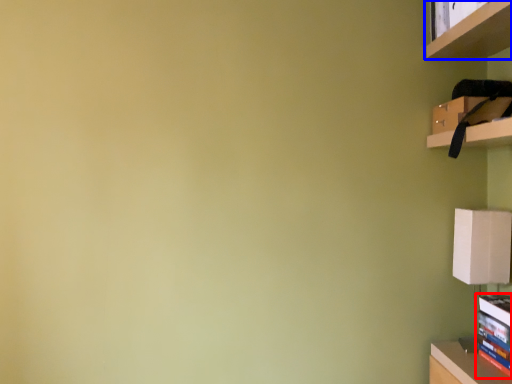
Question: Which point is closer to the camera, book (highlighted by a red box) or shelf (highlighted by a blue box)?

Choices:
 (A) book
 (B) shelf

Answer: (B)